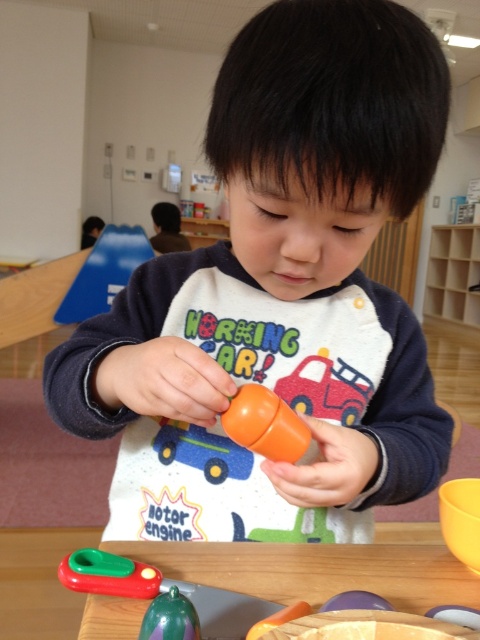
The daycare teacher wants to place both the orange matte toy at center and the orange matte toy car at center on a shelf that can only hold items up to 10 inches in width. Which item should they place first to ensure both fit?

The orange matte toy car at center should be placed first since the orange matte toy at center might be wider and therefore requires more space to fit both items on the shelf.

You are a teacher in the daycare and need to place a sticker on the orange matte cup at center. The sticker is 2 cm wide. Can you fit the sticker on the cup without overlapping any edges?

The orange matte cup at center is located at point (265, 424), so yes, the sticker can be placed on the cup without overlapping edges as long as the cup has enough space. However, the exact dimensions of the cup aren